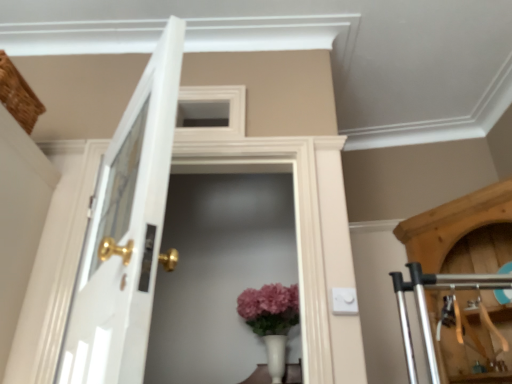
Question: From a real-world perspective, is white glossy door at left positioned above or below matte white vase at center?

Choices:
 (A) above
 (B) below

Answer: (A)

Question: Is white glossy door at left spatially inside matte white vase at center, or outside of it?

Choices:
 (A) inside
 (B) outside

Answer: (B)

Question: Estimate the real-world distances between objects in this image. Which object is farther from the matte white vase at center?

Choices:
 (A) white glossy door at left
 (B) white glass screen door at center

Answer: (A)

Question: Estimate the real-world distances between objects in this image. Which object is farther from the white glossy door at left?

Choices:
 (A) matte white vase at center
 (B) white glass screen door at center

Answer: (B)